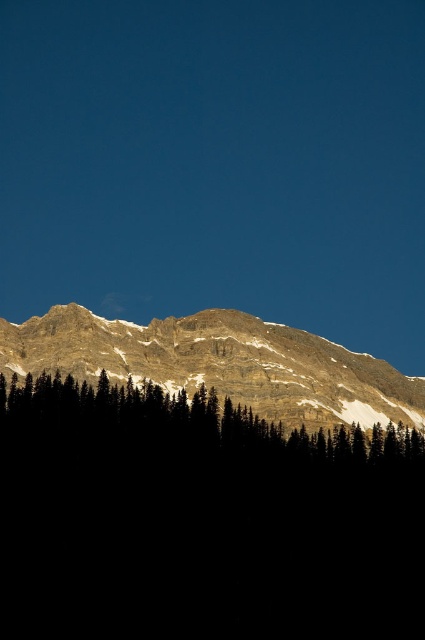
You are standing at the base of the mountain and see the point marked at coordinate (201, 520). According to the image, what is the location of this point relative to the green textured trees at lower center?

The point marked at coordinate (201, 520) is located on the green textured trees at lower center.

You are standing in front of the mountain landscape and want to place a small flag at each of the two points marked as point (22, 333) and point (28, 384). Which point is closer to you where you can place the flag without needing to move closer?

Point (22, 333) is closer to you than point (28, 384), so you can place the flag there without needing to move closer.

You are an outdoor photographer standing in front of the scene. You want to capture a photo where both the green textured trees at lower center and the rocky brown mountain range at upper center are in focus. Which object should you focus on first to ensure both are sharp?

You should focus on the green textured trees at lower center first since it is closer to the viewer than the rocky brown mountain range at upper center. By focusing on the closer object, the mountain will also be in focus due to the depth of field extending further back.